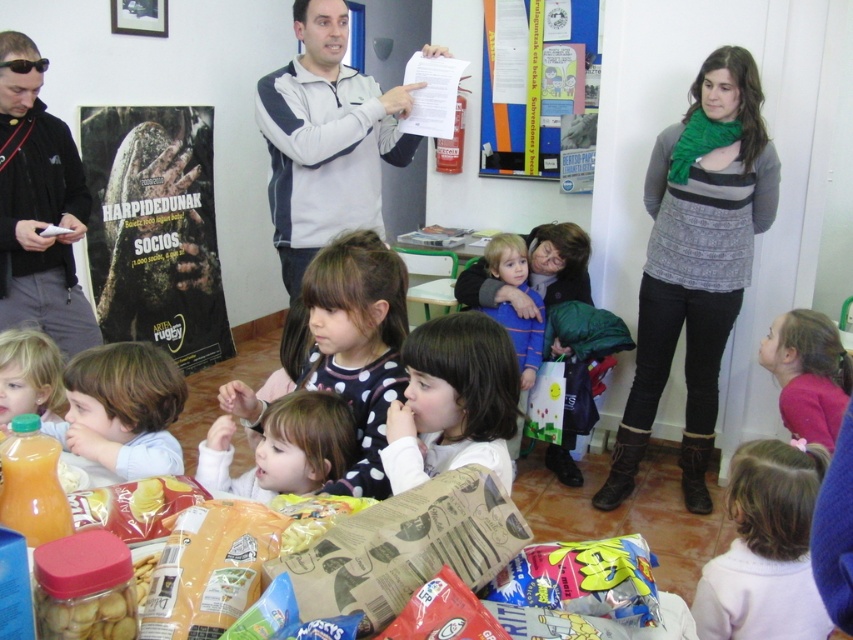
Does point (683, 145) come behind point (546, 296)?

No.

What do you see at coordinates (695, 262) in the screenshot? I see `green knitted scarf at upper right` at bounding box center [695, 262].

The height and width of the screenshot is (640, 853). Identify the location of green knitted scarf at upper right. (695, 262).

Who is shorter, polka dot fabric dress at center or translucent plastic bottle of orange juice at lower left?

With less height is translucent plastic bottle of orange juice at lower left.

Is polka dot fabric dress at center shorter than translucent plastic bottle of orange juice at lower left?

No.

The width and height of the screenshot is (853, 640). I want to click on polka dot fabric dress at center, so click(x=357, y=344).

Does sweatshirt at upper center have a lesser height compared to pink fabric at upper right?

Incorrect, sweatshirt at upper center's height does not fall short of pink fabric at upper right's.

This screenshot has height=640, width=853. I want to click on sweatshirt at upper center, so click(x=326, y=140).

Locate an element on the screen. This screenshot has width=853, height=640. sweatshirt at upper center is located at coordinates click(326, 140).